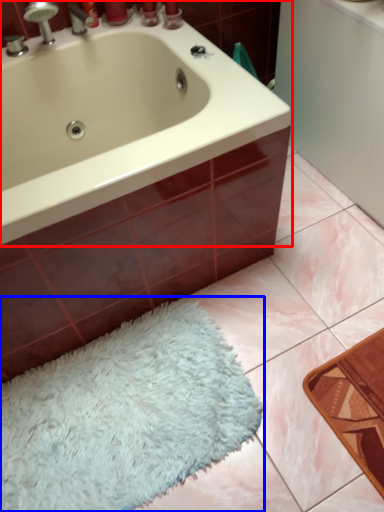
Question: Among these objects, which one is farthest to the camera, bathtub (highlighted by a red box) or bath mat (highlighted by a blue box)?

Choices:
 (A) bathtub
 (B) bath mat

Answer: (B)